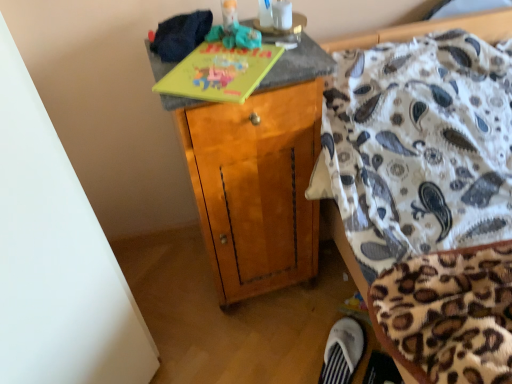
Where is `free space in front of rubberized green toy at upper center`? free space in front of rubberized green toy at upper center is located at coordinates (225, 70).